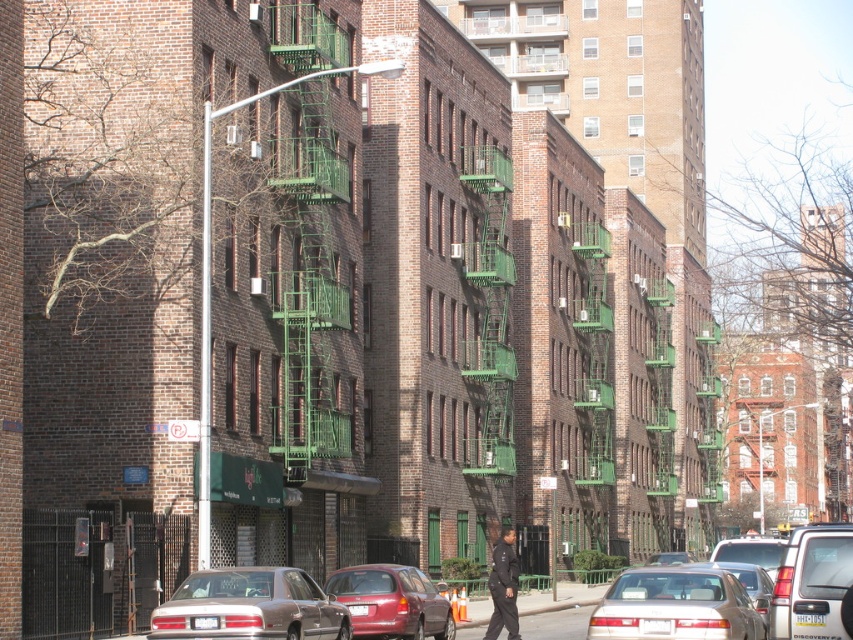
What do you see at coordinates (490, 312) in the screenshot? I see `green matte fire escape at center` at bounding box center [490, 312].

In the scene shown: Which of these two, green matte fire escape at center or dark blue uniform at center, stands shorter?

With less height is dark blue uniform at center.

Is point (496, 177) farther from viewer compared to point (492, 557)?

Yes, it is.

This screenshot has width=853, height=640. What are the coordinates of `green matte fire escape at center` in the screenshot? It's located at (490, 312).

Between point (322, 449) and point (798, 596), which one is positioned behind?

The point (322, 449) is behind.

Who is lower down, green metal fire escape at center or silver metallic suv at center right?

silver metallic suv at center right

Which is behind, point (294, 384) or point (811, 586)?

The point (294, 384) is behind.

What are the coordinates of `green metal fire escape at center` in the screenshot? It's located at (309, 243).

Which is below, gold metallic sedan at center or dark blue uniform at center?

dark blue uniform at center

Identify the location of gold metallic sedan at center. The height and width of the screenshot is (640, 853). (675, 605).

Find the location of a particular element. Image resolution: width=853 pixels, height=640 pixels. gold metallic sedan at center is located at coordinates (x=675, y=605).